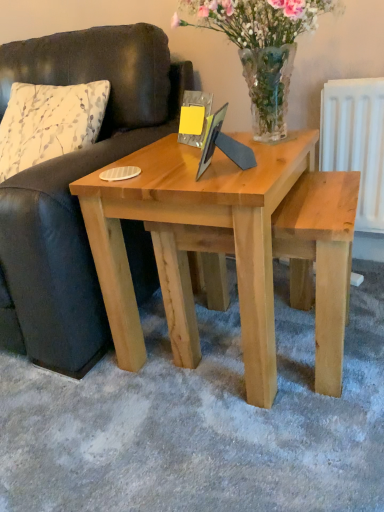
Question: Is leather couch at left to the left of white printed fabric pillow at left from the viewer's perspective?

Choices:
 (A) yes
 (B) no

Answer: (A)

Question: Is the depth of leather couch at left greater than that of white printed fabric pillow at left?

Choices:
 (A) yes
 (B) no

Answer: (B)

Question: From the image's perspective, is leather couch at left on white printed fabric pillow at left?

Choices:
 (A) no
 (B) yes

Answer: (A)

Question: From a real-world perspective, is leather couch at left over white printed fabric pillow at left?

Choices:
 (A) yes
 (B) no

Answer: (B)

Question: Would you say leather couch at left is outside white printed fabric pillow at left?

Choices:
 (A) yes
 (B) no

Answer: (A)

Question: Would you say white printed fabric pillow at left is inside or outside leather couch at left?

Choices:
 (A) outside
 (B) inside

Answer: (B)

Question: Considering the positions of white printed fabric pillow at left and leather couch at left in the image, is white printed fabric pillow at left bigger or smaller than leather couch at left?

Choices:
 (A) big
 (B) small

Answer: (B)

Question: In terms of width, does white printed fabric pillow at left look wider or thinner when compared to leather couch at left?

Choices:
 (A) wide
 (B) thin

Answer: (B)

Question: Is point (102, 108) positioned closer to the camera than point (39, 307)?

Choices:
 (A) farther
 (B) closer

Answer: (A)

Question: From the image's perspective, relative to white printed fabric pillow at left, is clear glass vase at center above or below?

Choices:
 (A) above
 (B) below

Answer: (A)

Question: Would you say clear glass vase at center is inside or outside white printed fabric pillow at left?

Choices:
 (A) outside
 (B) inside

Answer: (A)

Question: Does point (291, 41) appear closer or farther from the camera than point (44, 159)?

Choices:
 (A) farther
 (B) closer

Answer: (B)

Question: Based on their sizes in the image, would you say clear glass vase at center is bigger or smaller than white printed fabric pillow at left?

Choices:
 (A) big
 (B) small

Answer: (B)

Question: Is point (145, 275) positioned closer to the camera than point (129, 297)?

Choices:
 (A) closer
 (B) farther

Answer: (B)

Question: From the image's perspective, is leather couch at left located above or below natural wood coffee table at center?

Choices:
 (A) below
 (B) above

Answer: (B)